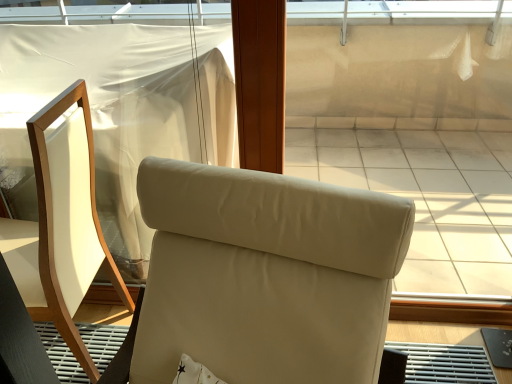
Describe the element at coordinates (263, 277) in the screenshot. I see `beige leather chair at center, positioned as the 1th chair in right-to-left order` at that location.

You are a GUI agent. You are given a task and a screenshot of the screen. Output one action in this format:
    pyautogui.click(x=<x>, y=<y>)
    Task: Click on the beige leather chair at center, positioned as the 1th chair in right-to-left order
    
    Given the screenshot: What is the action you would take?
    pyautogui.click(x=263, y=277)

This screenshot has width=512, height=384. Identify the location of matte white chair at left, which is the 2th chair in right-to-left order. coord(61,223).

What do you see at coordinates (61, 223) in the screenshot? I see `matte white chair at left, which is the 2th chair in right-to-left order` at bounding box center [61, 223].

I want to click on beige leather chair at center, positioned as the 1th chair in right-to-left order, so [263, 277].

Considering the relative positions of beige leather chair at center, which is the second chair from left to right, and matte white chair at left, which is the 2th chair in right-to-left order, in the image provided, is beige leather chair at center, which is the second chair from left to right, to the left or to the right of matte white chair at left, which is the 2th chair in right-to-left order,?

In the image, beige leather chair at center, which is the second chair from left to right, appears on the right side of matte white chair at left, which is the 2th chair in right-to-left order.

Is the position of beige leather chair at center, positioned as the 1th chair in right-to-left order, less distant than that of matte white chair at left, arranged as the first chair when viewed from the left?

Yes, the depth of beige leather chair at center, positioned as the 1th chair in right-to-left order, is less than that of matte white chair at left, arranged as the first chair when viewed from the left.

Is point (154, 303) behind point (38, 170)?

That is False.

From the image's perspective, which object appears higher, beige leather chair at center, positioned as the 1th chair in right-to-left order, or matte white chair at left, which is the 2th chair in right-to-left order?

matte white chair at left, which is the 2th chair in right-to-left order, is shown above in the image.

From a real-world perspective, relative to matte white chair at left, arranged as the first chair when viewed from the left, is beige leather chair at center, positioned as the 1th chair in right-to-left order, vertically above or below?

In terms of real-world spatial position, beige leather chair at center, positioned as the 1th chair in right-to-left order, is below matte white chair at left, arranged as the first chair when viewed from the left.

Looking at their sizes, would you say beige leather chair at center, positioned as the 1th chair in right-to-left order, is wider or thinner than matte white chair at left, arranged as the first chair when viewed from the left?

In the image, beige leather chair at center, positioned as the 1th chair in right-to-left order, appears to be wider than matte white chair at left, arranged as the first chair when viewed from the left.

Which of these two, beige leather chair at center, positioned as the 1th chair in right-to-left order, or matte white chair at left, which is the 2th chair in right-to-left order, stands shorter?

With less height is matte white chair at left, which is the 2th chair in right-to-left order.

Is beige leather chair at center, positioned as the 1th chair in right-to-left order, bigger than matte white chair at left, which is the 2th chair in right-to-left order?

Yes, beige leather chair at center, positioned as the 1th chair in right-to-left order, is bigger than matte white chair at left, which is the 2th chair in right-to-left order.

Consider the image. Choose the correct answer: Is beige leather chair at center, which is the second chair from left to right, inside matte white chair at left, arranged as the first chair when viewed from the left, or outside it?

beige leather chair at center, which is the second chair from left to right, is located beyond the bounds of matte white chair at left, arranged as the first chair when viewed from the left.

Could you tell me if beige leather chair at center, positioned as the 1th chair in right-to-left order, is turned towards matte white chair at left, which is the 2th chair in right-to-left order?

No, beige leather chair at center, positioned as the 1th chair in right-to-left order, does not turn towards matte white chair at left, which is the 2th chair in right-to-left order.

How different are the orientations of beige leather chair at center, positioned as the 1th chair in right-to-left order, and matte white chair at left, which is the 2th chair in right-to-left order, in degrees?

There is a 9.26-degree angle between the facing directions of beige leather chair at center, positioned as the 1th chair in right-to-left order, and matte white chair at left, which is the 2th chair in right-to-left order.

Locate an element on the screen. The height and width of the screenshot is (384, 512). chair below the matte white chair at left, which is the 2th chair in right-to-left order (from the image's perspective) is located at coordinates (263, 277).

Considering the relative positions of matte white chair at left, which is the 2th chair in right-to-left order, and beige leather chair at center, which is the second chair from left to right, in the image provided, is matte white chair at left, which is the 2th chair in right-to-left order, to the left or to the right of beige leather chair at center, which is the second chair from left to right,?

Based on their positions, matte white chair at left, which is the 2th chair in right-to-left order, is located to the left of beige leather chair at center, which is the second chair from left to right.

Considering the positions of objects matte white chair at left, which is the 2th chair in right-to-left order, and beige leather chair at center, positioned as the 1th chair in right-to-left order, in the image provided, who is in front, matte white chair at left, which is the 2th chair in right-to-left order, or beige leather chair at center, positioned as the 1th chair in right-to-left order,?

Positioned in front is beige leather chair at center, positioned as the 1th chair in right-to-left order.

Does point (69, 310) lie behind point (271, 278)?

That is True.

From the image's perspective, is matte white chair at left, arranged as the first chair when viewed from the left, located above beige leather chair at center, positioned as the 1th chair in right-to-left order?

Yes.

From a real-world perspective, who is located higher, matte white chair at left, which is the 2th chair in right-to-left order, or beige leather chair at center, positioned as the 1th chair in right-to-left order?

matte white chair at left, which is the 2th chair in right-to-left order.

Looking at their sizes, would you say matte white chair at left, arranged as the first chair when viewed from the left, is wider or thinner than beige leather chair at center, positioned as the 1th chair in right-to-left order?

Considering their sizes, matte white chair at left, arranged as the first chair when viewed from the left, looks slimmer than beige leather chair at center, positioned as the 1th chair in right-to-left order.

In terms of height, does matte white chair at left, arranged as the first chair when viewed from the left, look taller or shorter compared to beige leather chair at center, positioned as the 1th chair in right-to-left order?

In the image, matte white chair at left, arranged as the first chair when viewed from the left, appears to be shorter than beige leather chair at center, positioned as the 1th chair in right-to-left order.

Looking at the image, does matte white chair at left, which is the 2th chair in right-to-left order, seem bigger or smaller compared to beige leather chair at center, which is the second chair from left to right?

matte white chair at left, which is the 2th chair in right-to-left order, is smaller than beige leather chair at center, which is the second chair from left to right.

Do you think matte white chair at left, arranged as the first chair when viewed from the left, is within beige leather chair at center, positioned as the 1th chair in right-to-left order, or outside of it?

matte white chair at left, arranged as the first chair when viewed from the left, is outside beige leather chair at center, positioned as the 1th chair in right-to-left order.

Is matte white chair at left, which is the 2th chair in right-to-left order, not near beige leather chair at center, positioned as the 1th chair in right-to-left order?

Actually, matte white chair at left, which is the 2th chair in right-to-left order, and beige leather chair at center, positioned as the 1th chair in right-to-left order, are a little close together.

Is matte white chair at left, arranged as the first chair when viewed from the left, facing away from beige leather chair at center, which is the second chair from left to right?

That's not correct — matte white chair at left, arranged as the first chair when viewed from the left, is not looking away from beige leather chair at center, which is the second chair from left to right.

From the picture: How much distance is there between matte white chair at left, arranged as the first chair when viewed from the left, and beige leather chair at center, positioned as the 1th chair in right-to-left order?

matte white chair at left, arranged as the first chair when viewed from the left, and beige leather chair at center, positioned as the 1th chair in right-to-left order, are 21.83 inches apart.

I want to click on chair above the beige leather chair at center, which is the second chair from left to right (from a real-world perspective), so click(x=61, y=223).

In order to click on chair that appears in front of the matte white chair at left, which is the 2th chair in right-to-left order in this screenshot , I will do `click(263, 277)`.

At what (x,y) coordinates should I click in order to perform the action: click on chair behind the beige leather chair at center, which is the second chair from left to right. Please return your answer as a coordinate pair (x, y). The width and height of the screenshot is (512, 384). Looking at the image, I should click on (61, 223).